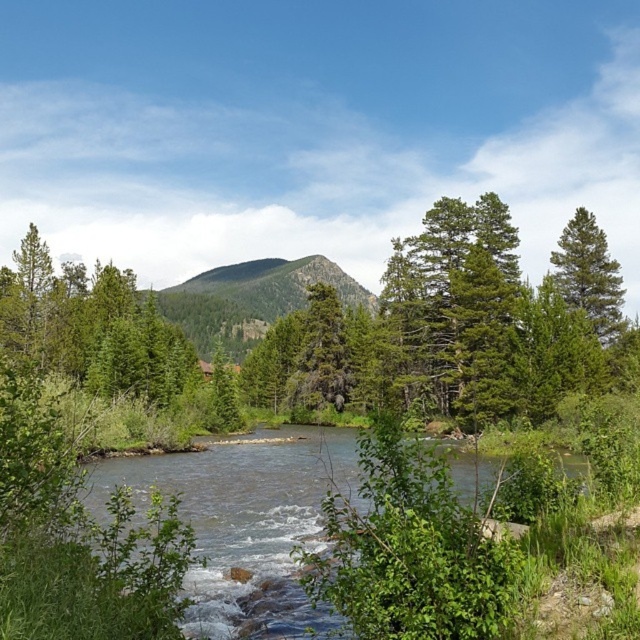
Based on the photo, you are planning to paint this landscape and want to ensure the proportions are accurate. Given the green textured mountain at center and the green matte tree at right, which object should you make wider in your painting to maintain the scene as shown?

The green textured mountain at center should be made wider in the painting since its width is larger than the green matte tree at right.

You are planning to cross the river using a small wooden raft that can only hold items occupying an area of 1 square meter. You need to determine if the clear water at center and the green matte tree at right can both fit on the raft. Based on their sizes, can they both be placed on the raft together?

The clear water at center is bigger than the green matte tree at right. Since the raft can only hold 1 square meter, and the combined size of both objects exceeds this limit, they cannot both be placed on the raft together.